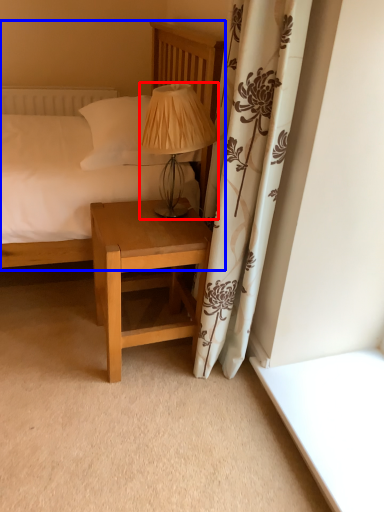
Question: Which object is further to the camera taking this photo, table lamp (highlighted by a red box) or bed (highlighted by a blue box)?

Choices:
 (A) table lamp
 (B) bed

Answer: (A)